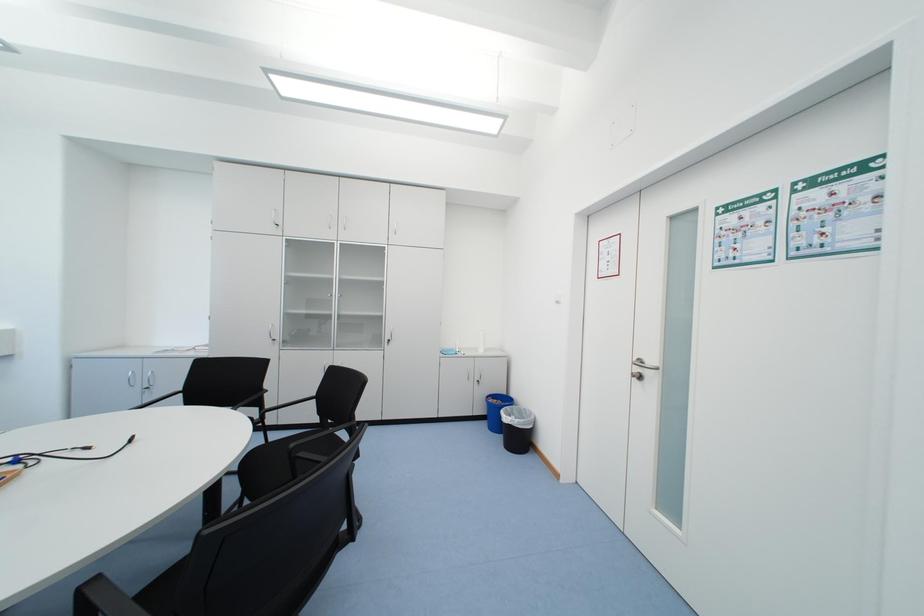
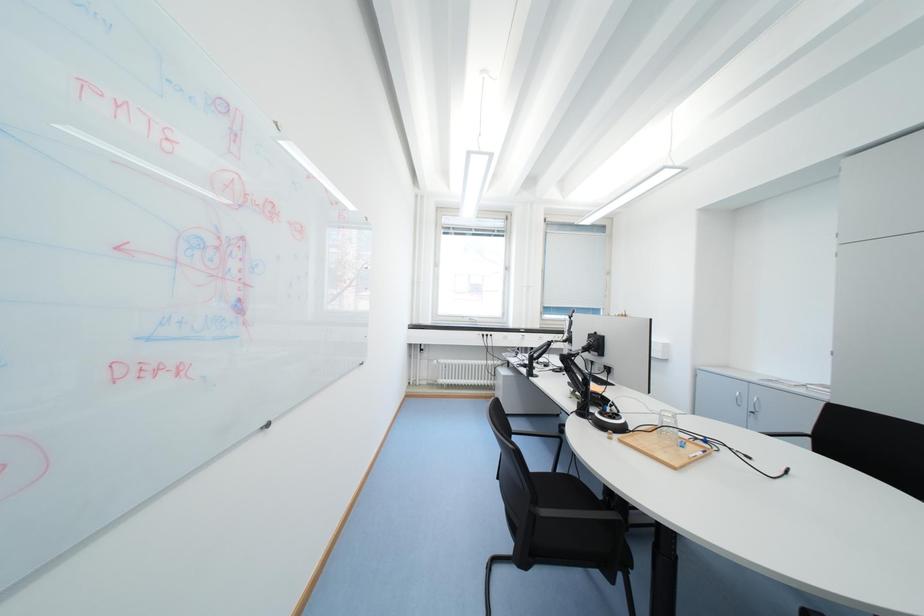
Question: The camera is either moving clockwise (left) or counter-clockwise (right) around the object. The first image is from the beginning of the video and the second image is from the end. Is the camera moving left or right when shooting the video?

Choices:
 (A) Left
 (B) Right

Answer: (B)